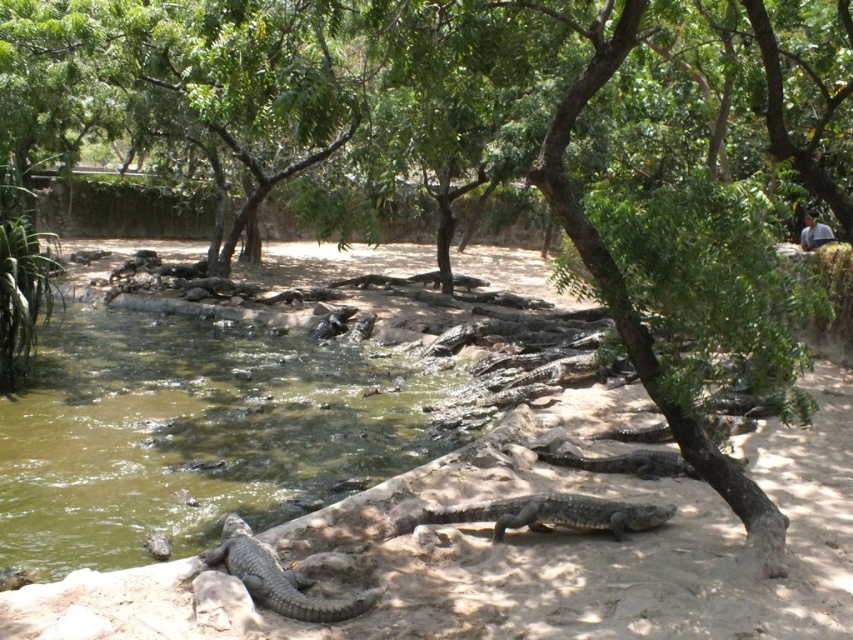
Question: Which of the following is the farthest from the observer?

Choices:
 (A) dark gray textured crocodile at center
 (B) gray scaly crocodile at lower left
 (C) greenish murky water at center

Answer: (A)

Question: Among these objects, which one is nearest to the camera?

Choices:
 (A) gray scaly crocodile at lower left
 (B) dark gray textured crocodile at center
 (C) greenish murky water at center

Answer: (A)

Question: Does dark gray textured crocodile at center have a greater width compared to gray scaly crocodile at lower left?

Choices:
 (A) no
 (B) yes

Answer: (B)

Question: Does greenish murky water at center come behind gray scaly crocodile at lower left?

Choices:
 (A) yes
 (B) no

Answer: (A)

Question: Does greenish murky water at center appear over gray scaly crocodile at lower left?

Choices:
 (A) yes
 (B) no

Answer: (A)

Question: Among these points, which one is farthest from the camera?

Choices:
 (A) (194, 349)
 (B) (287, 600)
 (C) (416, 515)

Answer: (A)